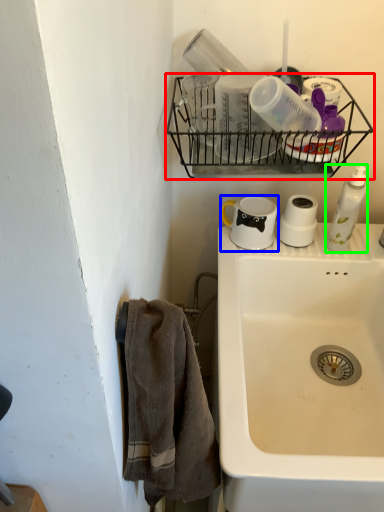
Question: Considering the real-world distances, which object is farthest from shelf (highlighted by a red box)? coffee cup (highlighted by a blue box) or soap dispenser (highlighted by a green box)?

Choices:
 (A) coffee cup
 (B) soap dispenser

Answer: (B)